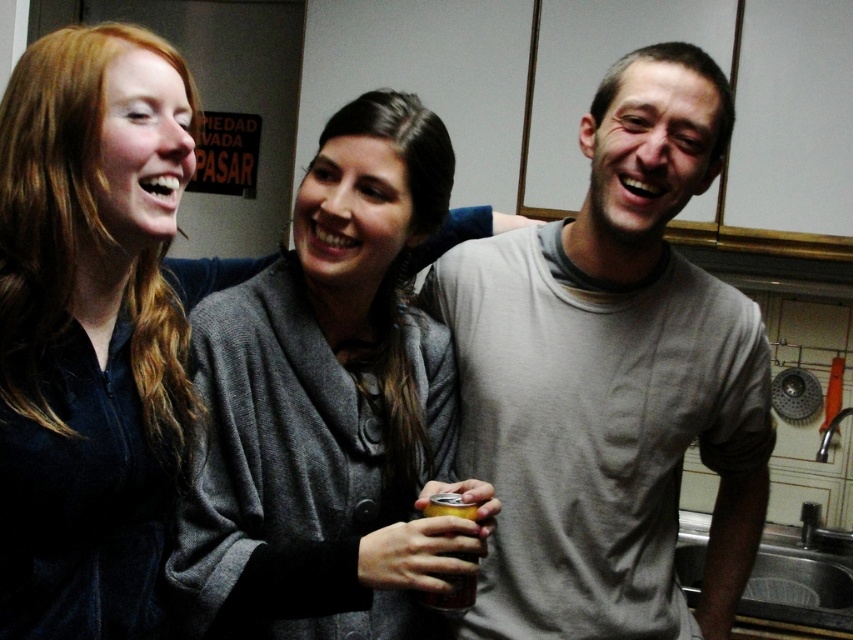
Based on the scene description, which object is located below the other between the gray wool sweater at center and the velvet dark blue shirt at left?

The gray wool sweater at center is positioned under the velvet dark blue shirt at left, so the sweater is below the shirt.

You are trying to decide which of the two items to wear for a casual dinner. Based on the image, which clothing item between the gray wool sweater at center and the velvet dark blue shirt at left would be more appropriate if you want a looser, more comfortable fit?

The gray wool sweater at center has a larger size compared to the velvet dark blue shirt at left, so it would be more appropriate for a looser, more comfortable fit.